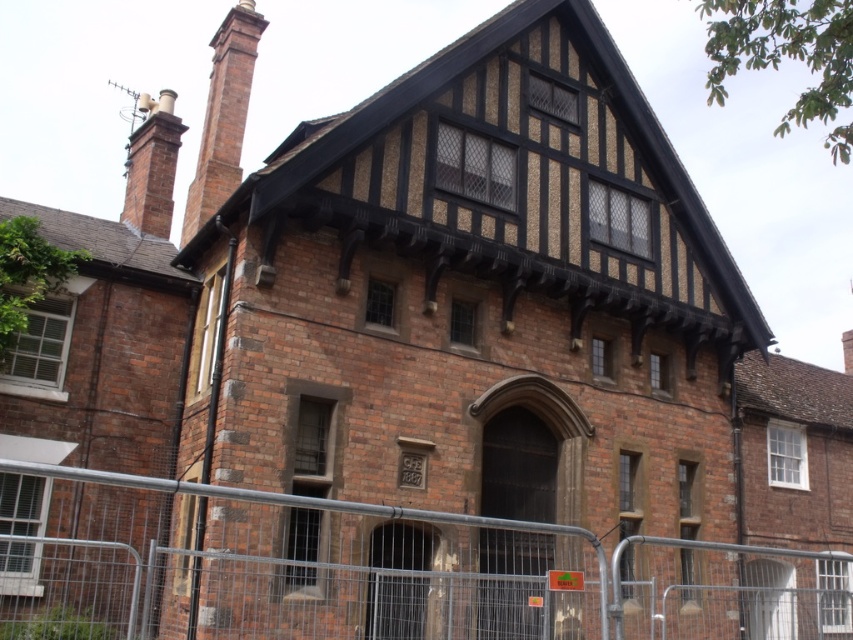
From the picture: You are a painter hired to paint the metal fence at center and the brick chimney at upper left. You have a ladder that can reach up to 2 meters. Can you safely paint both objects without needing a taller ladder?

The metal fence at center is taller than the brick chimney at upper left. Since the ladder can reach up to 2 meters, you need to determine if both objects are within that height limit. However, without knowing their exact heights, only the relative height between them is provided. Therefore, it is impossible to confirm if the ladder is sufficient for both.